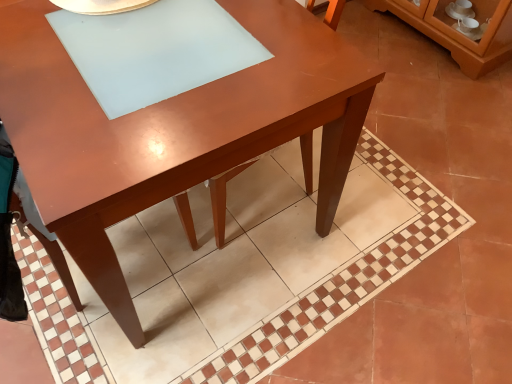
Locate an element on the screen. Image resolution: width=512 pixels, height=384 pixels. free spot to the right of matte brown table at center is located at coordinates (410, 205).